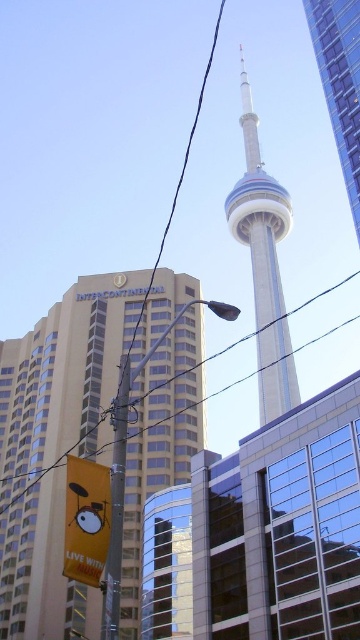
Between point (230, 196) and point (123, 458), which one is positioned behind?

The point (230, 196) is behind.

Is point (281, 195) less distant than point (118, 572)?

No, it is not.

Locate an element on the screen. The image size is (360, 640). white glass tower at center is located at coordinates (263, 262).

Who is taller, silver metallic cn tower at center or black wire at upper center?

black wire at upper center is taller.

Does silver metallic cn tower at center appear under black wire at upper center?

No.

The width and height of the screenshot is (360, 640). Identify the location of silver metallic cn tower at center. (339, 81).

Is yellow matte banner at lower left below metallic wire at center?

Correct, yellow matte banner at lower left is located below metallic wire at center.

Between point (79, 548) and point (216, 394), which one is positioned behind?

The point (216, 394) is behind.

Is point (97, 465) less distant than point (313, 296)?

Yes, point (97, 465) is closer to viewer.

The width and height of the screenshot is (360, 640). I want to click on yellow matte banner at lower left, so click(86, 520).